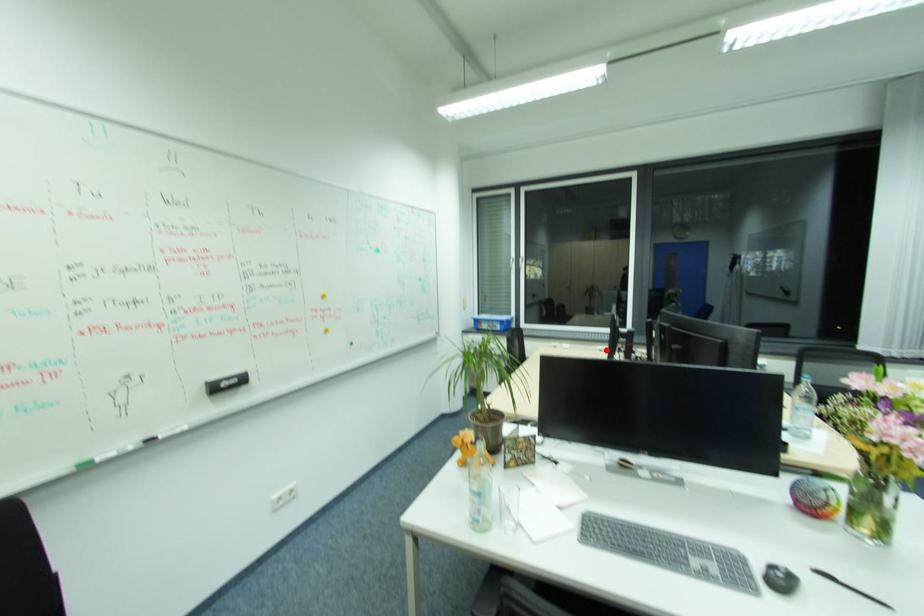
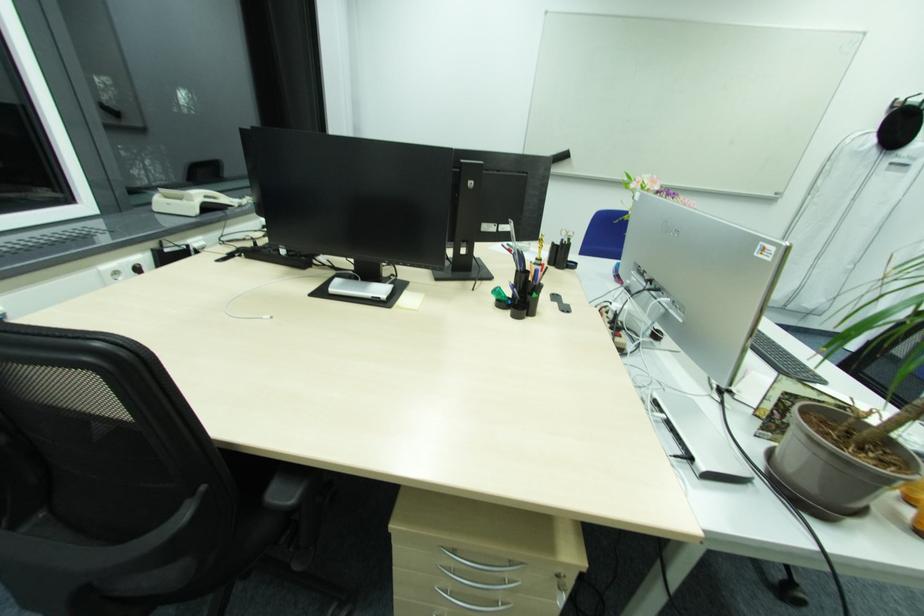
The point at the highlighted location is marked in the first image. Where is the corresponding point in the second image?

(120, 272)